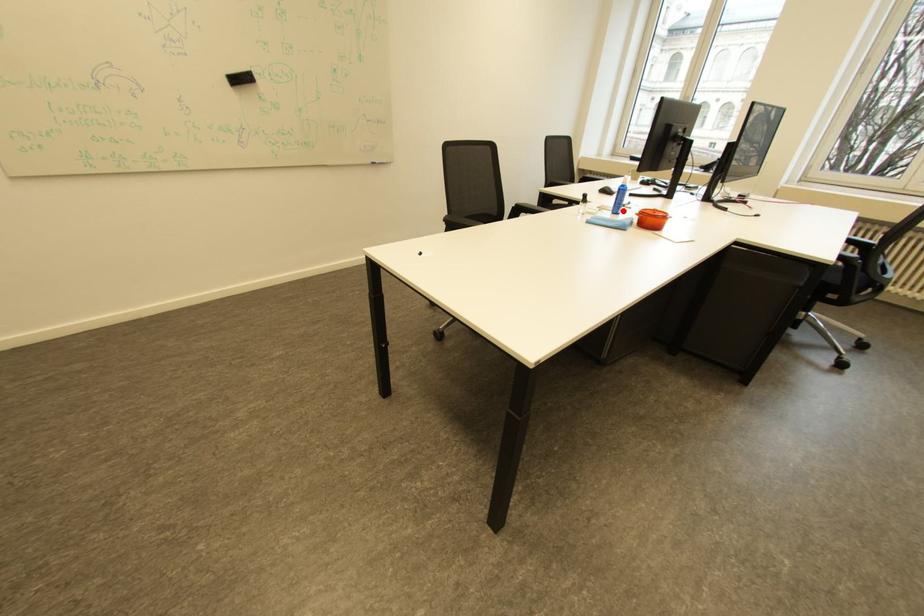
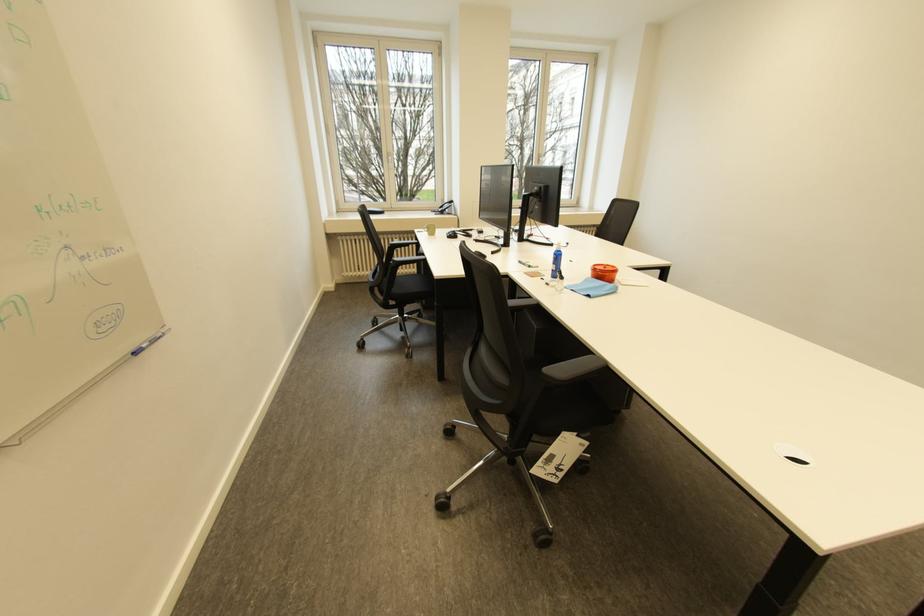
The point at the highlighted location is marked in the first image. Where is the corresponding point in the second image?

(562, 276)